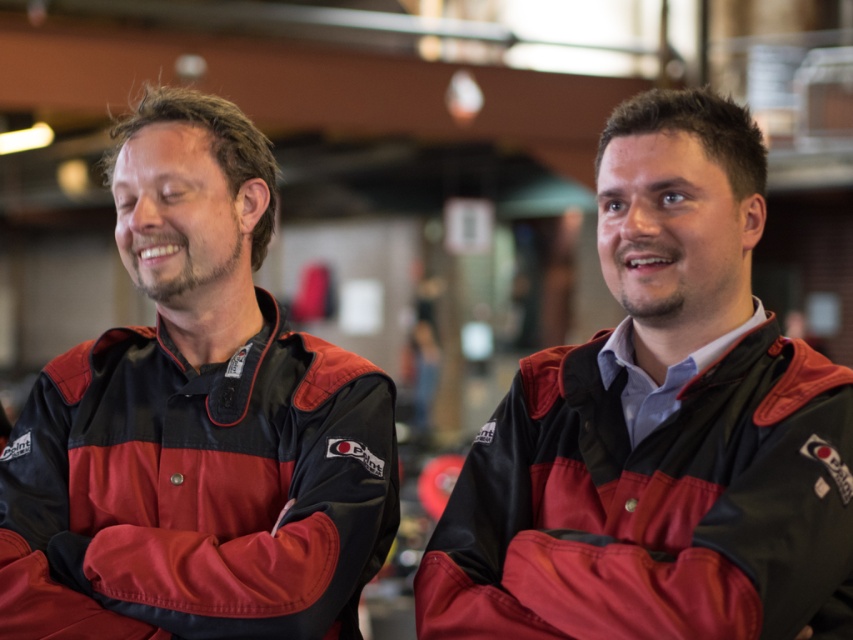
Question: Can you confirm if matte black jacket at center is smaller than matte nylon jacket at center?

Choices:
 (A) no
 (B) yes

Answer: (A)

Question: Is matte black jacket at left thinner than matte nylon jacket at center?

Choices:
 (A) no
 (B) yes

Answer: (A)

Question: Which of the following is the farthest from the observer?

Choices:
 (A) (334, 618)
 (B) (543, 522)
 (C) (163, 420)

Answer: (C)

Question: Is matte black jacket at left to the right of matte nylon jacket at center from the viewer's perspective?

Choices:
 (A) no
 (B) yes

Answer: (A)

Question: Estimate the real-world distances between objects in this image. Which object is farther from the matte nylon jacket at center?

Choices:
 (A) matte black jacket at center
 (B) matte black jacket at left

Answer: (A)

Question: Among these objects, which one is farthest from the camera?

Choices:
 (A) matte black jacket at left
 (B) matte black jacket at center
 (C) matte nylon jacket at center

Answer: (A)